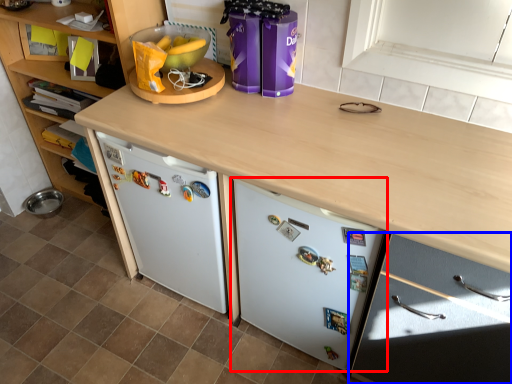
Question: Which object is further to the camera taking this photo, refrigerator (highlighted by a red box) or cabinetry (highlighted by a blue box)?

Choices:
 (A) refrigerator
 (B) cabinetry

Answer: (A)